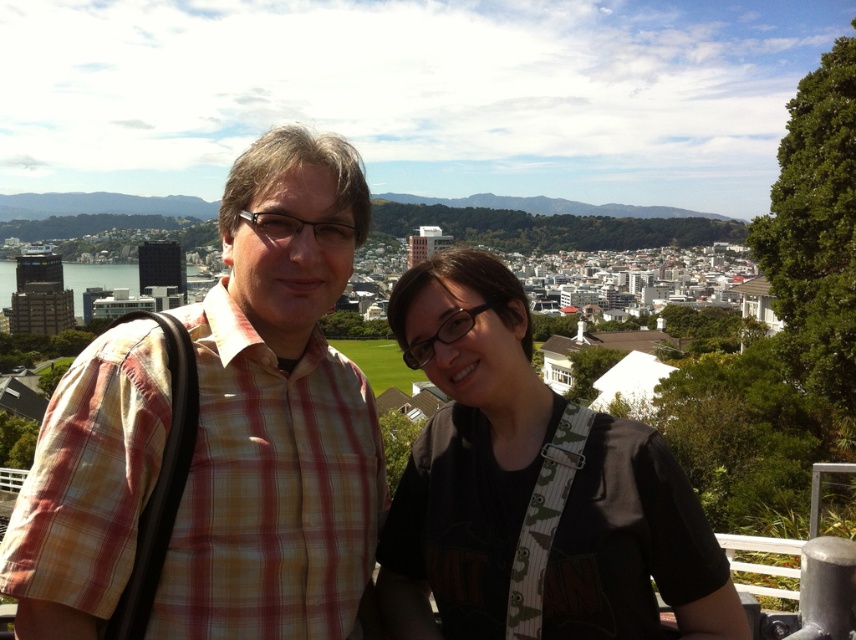
You are taking a photo of the city from the viewpoint where the two people are standing. You notice two points in the foreground, one at coordinates point (361, 516) and the other at point (652, 484). Which point will appear closer to the camera in your photo?

Point (361, 516) is further to the camera than point (652, 484), so the point at (361, 516) will appear closer to the camera in the photo.

You are a photographer trying to capture both individuals in a single frame. Given that the plaid shirt at center and the black matte shirt at center are positioned side by side, which of their shirts would appear narrower in the photo?

The plaid shirt at center has a lesser width compared to the black matte shirt at center, so the plaid shirt at center would appear narrower in the photo.